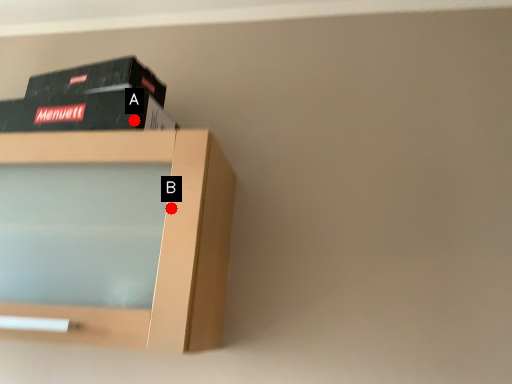
Question: Two points are circled on the image, labeled by A and B beside each circle. Which point is farther to the camera?

Choices:
 (A) A is further
 (B) B is further

Answer: (A)